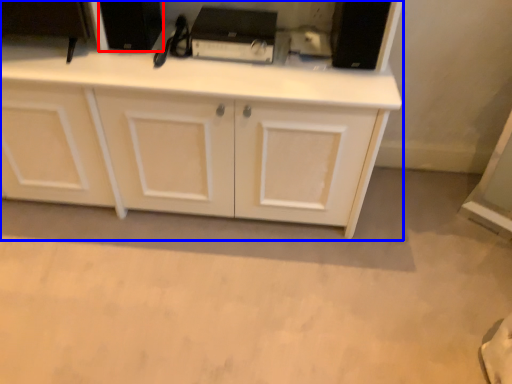
Question: Which of the following is the closest to the observer, appliance (highlighted by a red box) or cabinetry (highlighted by a blue box)?

Choices:
 (A) appliance
 (B) cabinetry

Answer: (B)